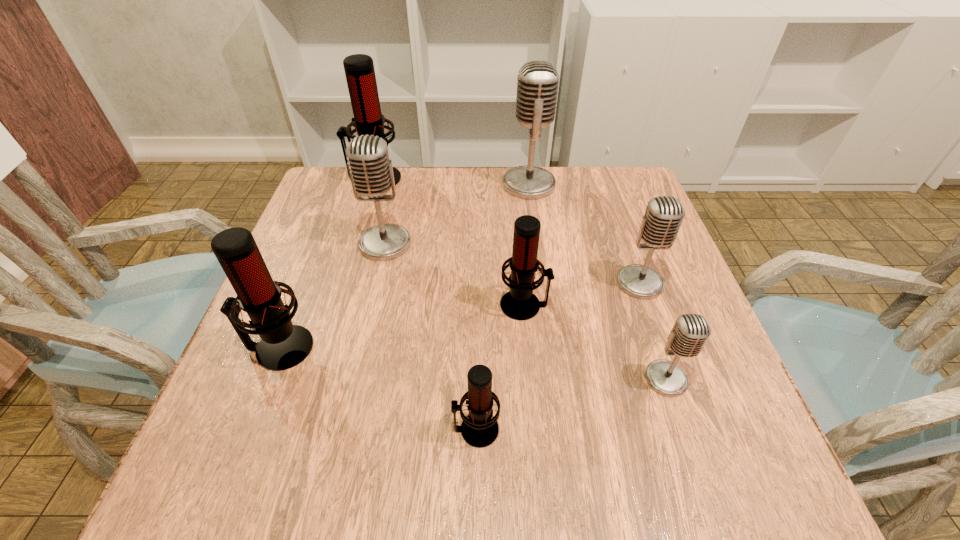
Where is `the nearest object`? The height and width of the screenshot is (540, 960). the nearest object is located at coordinates (479, 429).

This screenshot has width=960, height=540. What are the coordinates of `the fifth object from right to left` in the screenshot? It's located at (479, 429).

At what (x,y) coordinates should I click in order to perform the action: click on vacant area situated 0.300m on the front of the farthest red microphone. Please return your answer as a coordinate pair (x, y). The width and height of the screenshot is (960, 540). Looking at the image, I should click on (348, 267).

Where is `vacant space located on the front of the second gray microphone from left to right`? The height and width of the screenshot is (540, 960). vacant space located on the front of the second gray microphone from left to right is located at coordinates (540, 268).

This screenshot has width=960, height=540. Find the location of `blank space located 0.090m on the right of the third farthest microphone`. blank space located 0.090m on the right of the third farthest microphone is located at coordinates (449, 244).

Locate an element on the screen. The width and height of the screenshot is (960, 540). vacant space located 0.210m on the right of the second biggest red microphone is located at coordinates (424, 348).

Where is `vacant region located 0.140m on the left of the second nearest gray microphone`? The image size is (960, 540). vacant region located 0.140m on the left of the second nearest gray microphone is located at coordinates (552, 283).

Image resolution: width=960 pixels, height=540 pixels. I want to click on free point located 0.260m on the right of the rightmost red microphone, so click(x=675, y=305).

You are a GUI agent. You are given a task and a screenshot of the screen. Output one action in this format:
    pyautogui.click(x=<x>, y=<y>)
    Task: Click on the vacant space located on the left of the nearest gray microphone
    
    Given the screenshot: What is the action you would take?
    pyautogui.click(x=584, y=379)

Locate an element on the screen. The image size is (960, 540). vacant space located on the back of the nearest object is located at coordinates (477, 274).